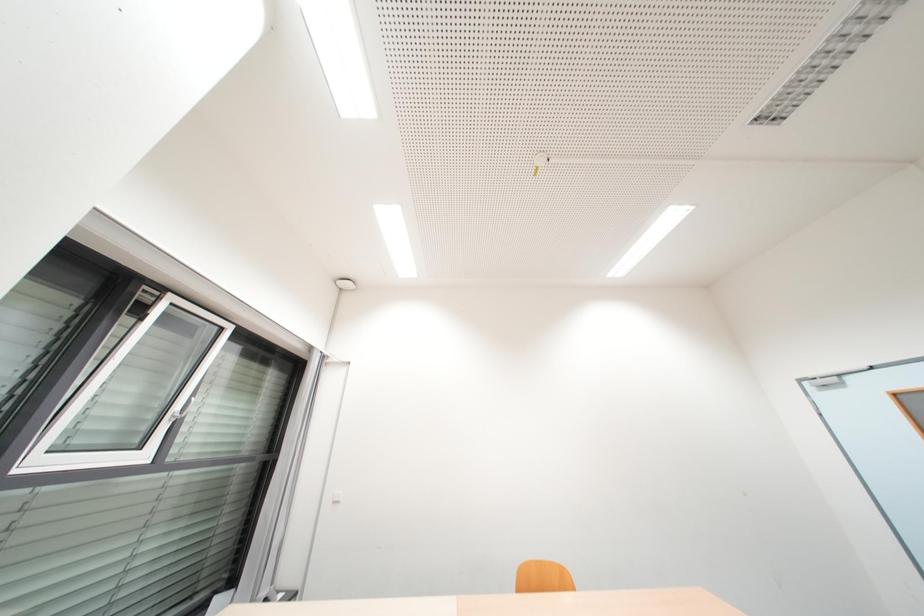
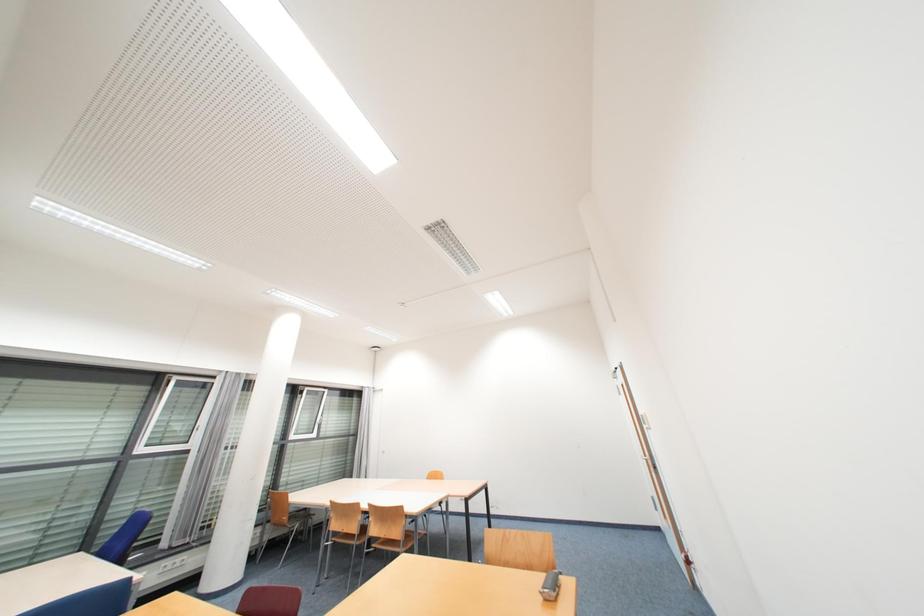
The images are taken continuously from a first-person perspective. In which direction are you moving?

The cameraman moved toward right, backward.